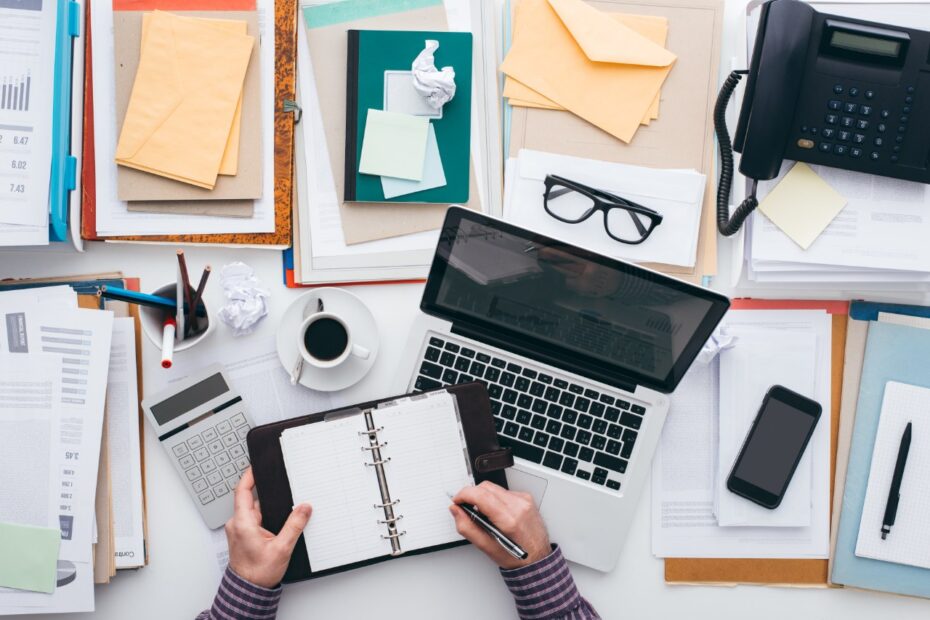
Find the location of a particular element. This screenshot has width=930, height=620. pens is located at coordinates (124, 290), (165, 335), (179, 291), (186, 281), (204, 281), (467, 508), (894, 490).